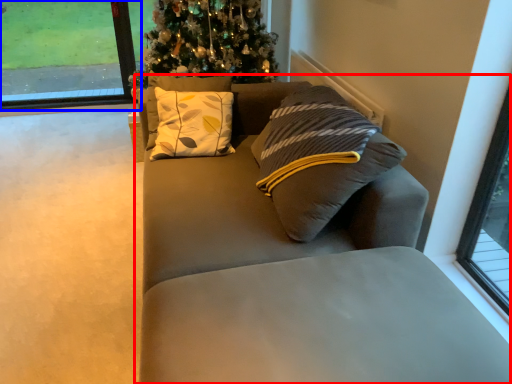
Question: Which object is further to the camera taking this photo, studio couch (highlighted by a red box) or window (highlighted by a blue box)?

Choices:
 (A) studio couch
 (B) window

Answer: (B)